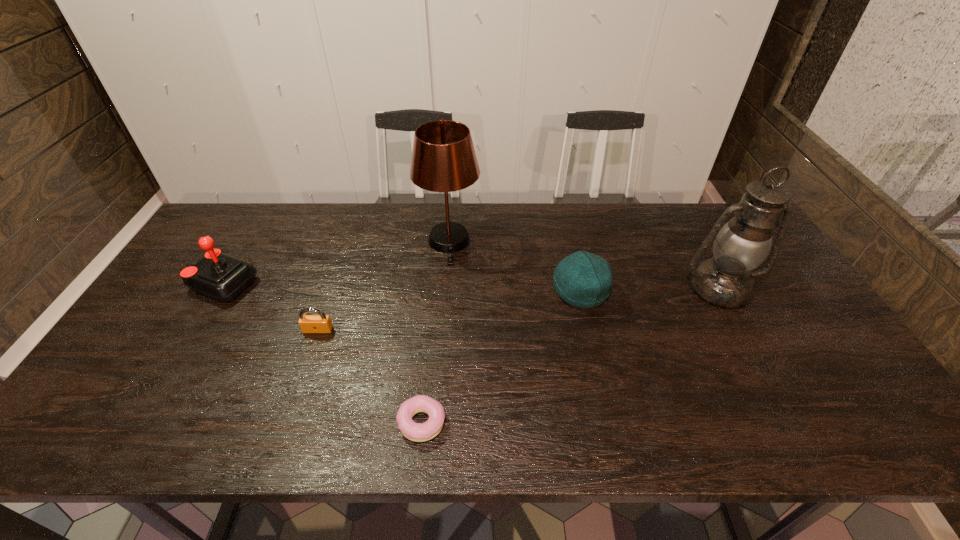
Identify the location of lampshade. This screenshot has height=540, width=960. (443, 159).

The height and width of the screenshot is (540, 960). Identify the location of the rightmost object. [741, 245].

Locate an element on the screen. the fourth shortest object is located at coordinates (220, 276).

At what (x,y) coordinates should I click in order to perform the action: click on the leftmost object. Please return your answer as a coordinate pair (x, y). Looking at the image, I should click on (220, 276).

At what (x,y) coordinates should I click in order to perform the action: click on beanie. Please return your answer as a coordinate pair (x, y). The height and width of the screenshot is (540, 960). Looking at the image, I should click on (582, 279).

At what (x,y) coordinates should I click in order to perform the action: click on the fourth tallest object. Please return your answer as a coordinate pair (x, y). Image resolution: width=960 pixels, height=540 pixels. Looking at the image, I should click on (582, 279).

This screenshot has height=540, width=960. What are the coordinates of `the second nearest object` in the screenshot? It's located at (321, 323).

You are a GUI agent. You are given a task and a screenshot of the screen. Output one action in this format:
    pyautogui.click(x=<x>, y=<y>)
    Task: Click on the fifth object from right to left
    Image resolution: width=960 pixels, height=540 pixels.
    Given the screenshot: What is the action you would take?
    pyautogui.click(x=321, y=323)

The image size is (960, 540). In order to click on doughnut in this screenshot , I will do `click(418, 432)`.

Where is `the nearest object`? the nearest object is located at coordinates (418, 432).